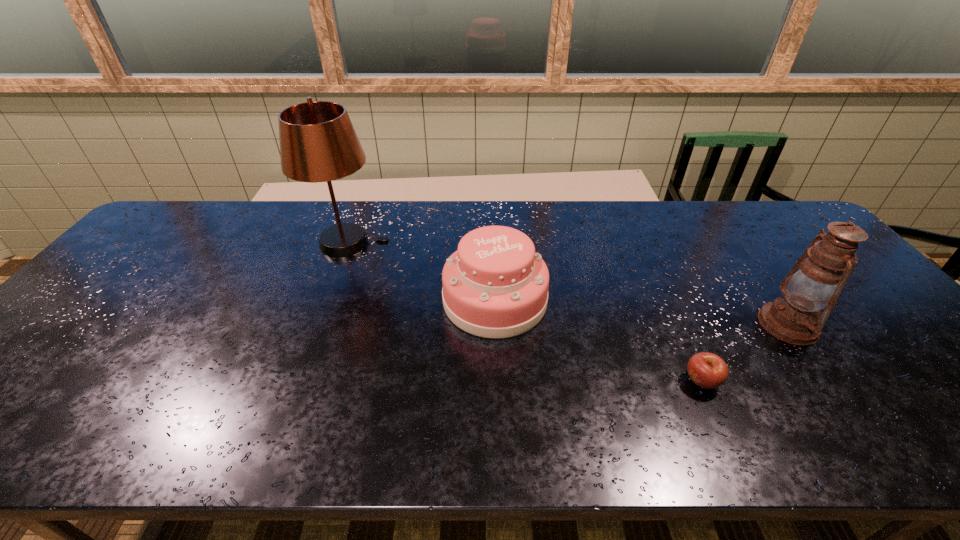
At what (x,y) coordinates should I click in order to perform the action: click on free space located 0.270m on the back of the second shortest object. Please return your answer as a coordinate pair (x, y). The width and height of the screenshot is (960, 540). Looking at the image, I should click on (492, 217).

Locate an element on the screen. Image resolution: width=960 pixels, height=540 pixels. vacant point located on the side of the apple with the unique marking is located at coordinates (529, 381).

Where is `free region located on the side of the apple with the unique marking`? free region located on the side of the apple with the unique marking is located at coordinates (609, 381).

What are the coordinates of `free spot located 0.160m on the side of the apple with the unique marking` in the screenshot? It's located at (613, 381).

Where is `object that is positioned at the far edge`? The width and height of the screenshot is (960, 540). object that is positioned at the far edge is located at coordinates (318, 143).

I want to click on free space at the far edge, so click(x=589, y=231).

In the image, there is a desktop. Identify the location of vacant region at the far right corner. This screenshot has height=540, width=960. (800, 222).

Where is `vacant space in between the nearest object and the oil lamp`? This screenshot has height=540, width=960. vacant space in between the nearest object and the oil lamp is located at coordinates (745, 353).

Where is `free space between the tallest object and the oil lamp`? This screenshot has width=960, height=540. free space between the tallest object and the oil lamp is located at coordinates pos(568,284).

Find the location of a particular element. The width and height of the screenshot is (960, 540). empty location between the third object from left to right and the third object from right to left is located at coordinates (598, 341).